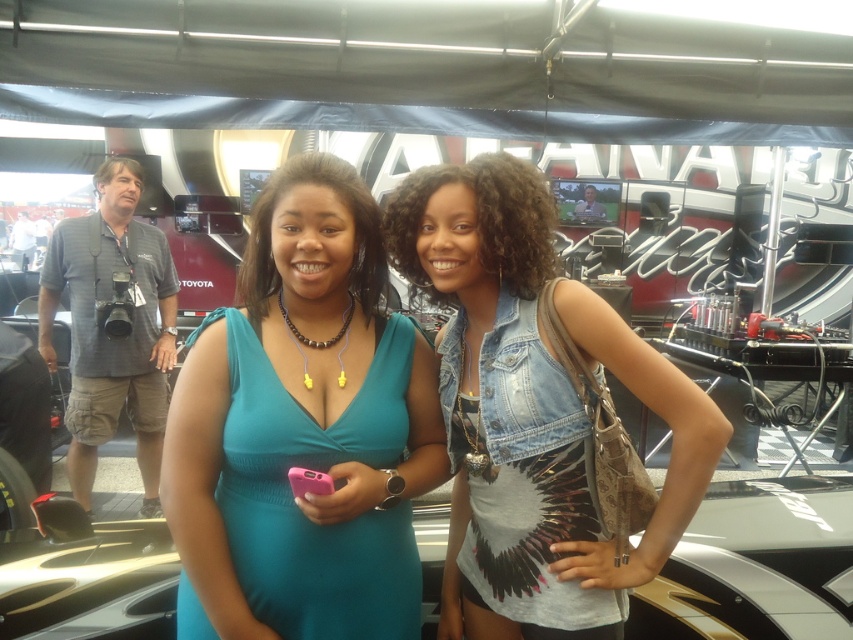
You are at an event and need to take a photo of both the teal fabric dress at center and the denim vest at center. Considering their heights, which one might you need to adjust your camera angle to capture properly?

The teal fabric dress at center is shorter than the denim vest at center, so you might need to lower your camera angle slightly to ensure both are fully visible in the photo.

You are organizing a clothing donation drive and need to determine if the teal fabric dress at center can fit inside the denim vest at center for transport. Based on their sizes, is this possible?

The teal fabric dress at center is smaller than the denim vest at center, so it can fit inside the denim vest at center for transport.